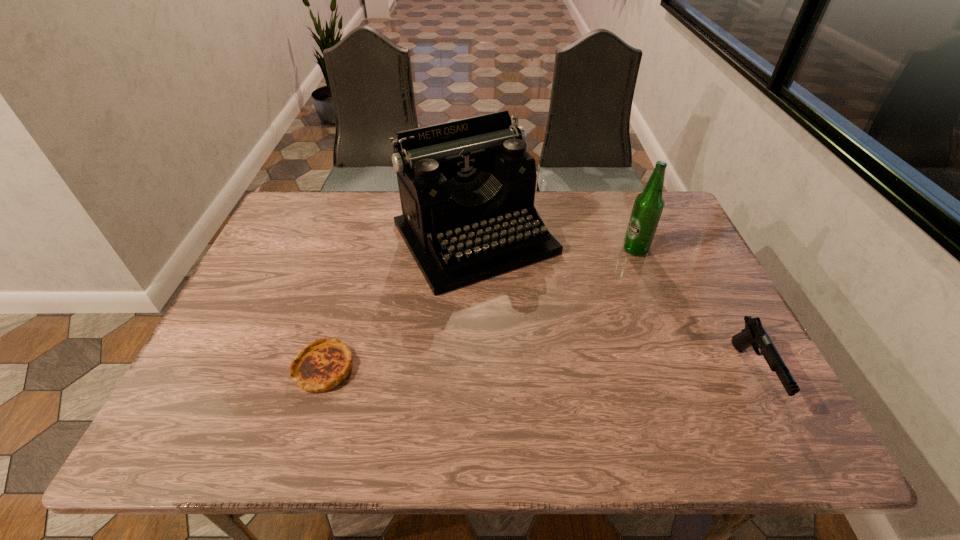
At what (x,y) coordinates should I click in order to perform the action: click on the leftmost object. Please return your answer as a coordinate pair (x, y). Looking at the image, I should click on (323, 364).

Locate an element on the screen. The height and width of the screenshot is (540, 960). quiche is located at coordinates (323, 364).

Identify the location of gun. (754, 334).

This screenshot has height=540, width=960. Identify the location of the second shortest object. (754, 334).

I want to click on the third object from right to left, so click(x=467, y=187).

Find the location of a particular element. beer bottle is located at coordinates (648, 206).

The height and width of the screenshot is (540, 960). In order to click on vacant space located 0.220m on the right of the leftmost object in this screenshot , I will do `click(452, 367)`.

Locate an element on the screen. The width and height of the screenshot is (960, 540). blank area located 0.050m on the typing side of the typewriter is located at coordinates (525, 302).

This screenshot has width=960, height=540. In order to click on free space located 0.100m on the typing side of the typewriter in this screenshot , I will do `click(535, 316)`.

This screenshot has width=960, height=540. In order to click on vacant space located 0.340m on the typing side of the typewriter in this screenshot , I will do `click(592, 393)`.